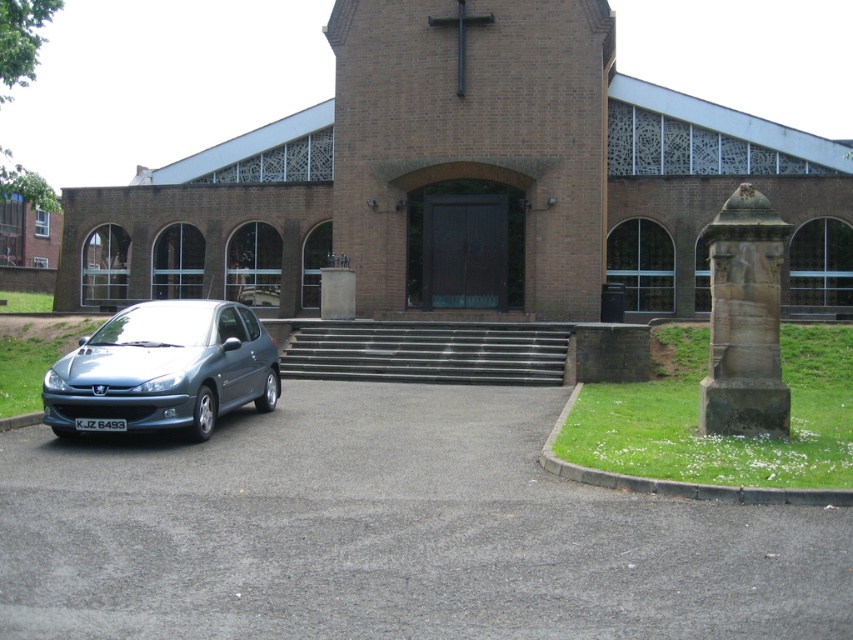
Question: Is brick church at center closer to camera compared to satin metallic car at lower left?

Choices:
 (A) no
 (B) yes

Answer: (A)

Question: Which point is farther to the camera?

Choices:
 (A) satin metallic car at lower left
 (B) brick church at center

Answer: (B)

Question: Does brick church at center appear over satin metallic car at lower left?

Choices:
 (A) yes
 (B) no

Answer: (A)

Question: Is the position of brick church at center less distant than that of satin metallic car at lower left?

Choices:
 (A) no
 (B) yes

Answer: (A)